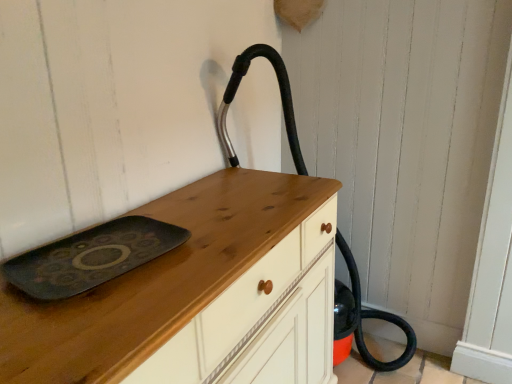
Question: Does wooden chest of drawers at center have a larger size compared to matte black tray at center?

Choices:
 (A) no
 (B) yes

Answer: (B)

Question: Can you confirm if wooden chest of drawers at center is taller than matte black tray at center?

Choices:
 (A) yes
 (B) no

Answer: (A)

Question: Does wooden chest of drawers at center touch matte black tray at center?

Choices:
 (A) yes
 (B) no

Answer: (B)

Question: Is wooden chest of drawers at center in front of matte black tray at center?

Choices:
 (A) no
 (B) yes

Answer: (B)

Question: Is wooden chest of drawers at center looking in the opposite direction of matte black tray at center?

Choices:
 (A) yes
 (B) no

Answer: (B)

Question: From a real-world perspective, is wooden chest of drawers at center physically above matte black tray at center?

Choices:
 (A) no
 (B) yes

Answer: (A)

Question: From the image's perspective, would you say matte black tray at center is positioned over wooden chest of drawers at center?

Choices:
 (A) yes
 (B) no

Answer: (A)

Question: Is wooden chest of drawers at center surrounded by matte black tray at center?

Choices:
 (A) yes
 (B) no

Answer: (B)

Question: Is matte black tray at center positioned beyond the bounds of wooden chest of drawers at center?

Choices:
 (A) yes
 (B) no

Answer: (B)

Question: Can you confirm if matte black tray at center is bigger than wooden chest of drawers at center?

Choices:
 (A) yes
 (B) no

Answer: (B)

Question: Does matte black tray at center have a greater height compared to wooden chest of drawers at center?

Choices:
 (A) yes
 (B) no

Answer: (B)

Question: Is matte black tray at center in contact with wooden chest of drawers at center?

Choices:
 (A) yes
 (B) no

Answer: (B)

Question: From the image's perspective, is matte black tray at center above black rubber hose at center?

Choices:
 (A) no
 (B) yes

Answer: (A)